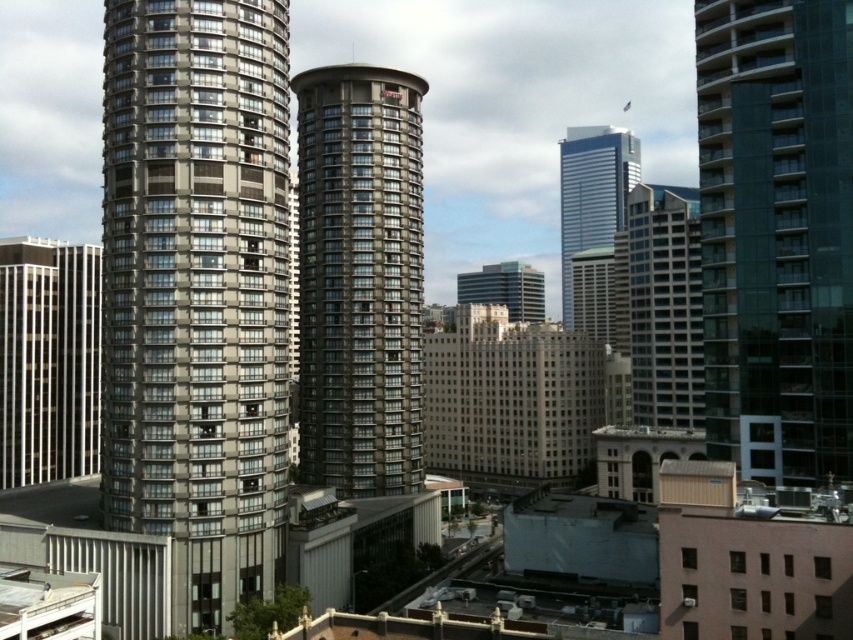
You are an architect analyzing the city layout. You observe the gray glass building at left and the gray glassy building at center. Which one is located to the east if the buildings are aligned along a north to south axis?

The gray glass building at left is positioned on the left side of gray glassy building at center. Since the buildings are aligned along a north to south axis, the left side would correspond to the east direction. Therefore, the gray glass building at left is located to the east.

You are an architect evaluating the cityscape. You need to determine which of the two glassy skyscrapers, the glassy teal skyscraper at right or the glassy gray skyscraper at center, is taller. Based on the scene, which one is taller?

The glassy gray skyscraper at center is taller than the glassy teal skyscraper at right.